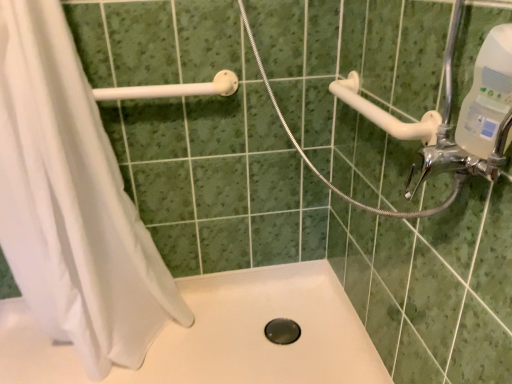
The image size is (512, 384). What are the coordinates of `chrome metallic faucet at upper right` in the screenshot? It's located at (458, 158).

This screenshot has width=512, height=384. What do you see at coordinates (282, 331) in the screenshot?
I see `black rubber hole at center` at bounding box center [282, 331].

In order to face black rubber hole at center, should I rotate leftwards or rightwards?

To align with it, rotate right about 3.227°.

This screenshot has height=384, width=512. In order to click on white plastic grab bar at upper left, the first shower in the left-to-right sequence in this screenshot , I will do `click(173, 89)`.

Identify the location of white plastic grab bar at upper right, which ranks as the first shower in right-to-left order. Image resolution: width=512 pixels, height=384 pixels. (386, 113).

This screenshot has height=384, width=512. What do you see at coordinates (262, 332) in the screenshot?
I see `white matte bath at center` at bounding box center [262, 332].

Measure the distance between point (40, 261) and camera.

The distance of point (40, 261) from camera is 1.26 meters.

This screenshot has width=512, height=384. What are the coordinates of `chrome metallic faucet at upper right` in the screenshot? It's located at (458, 158).

Is black rubber hole at center next to white plastic grab bar at upper right, which ranks as the first shower in right-to-left order, and touching it?

black rubber hole at center is not next to white plastic grab bar at upper right, which ranks as the first shower in right-to-left order, and they're not touching.

Find the location of a particular element. This screenshot has height=384, width=512. shower that is the 1st one when counting upward from the black rubber hole at center (from the image's perspective) is located at coordinates (386, 113).

How far apart are black rubber hole at center and white plastic grab bar at upper right, the 2th shower positioned from the left?

They are 35.98 inches apart.

From a real-world perspective, who is located higher, black rubber hole at center or white plastic grab bar at upper right, which ranks as the first shower in right-to-left order?

From a 3D spatial view, white plastic grab bar at upper right, which ranks as the first shower in right-to-left order, is above.

Which object is positioned more to the left, chrome metallic faucet at upper right or white fabric shower curtain at left?

white fabric shower curtain at left is more to the left.

Is white fabric shower curtain at left completely or partially inside chrome metallic faucet at upper right?

No, chrome metallic faucet at upper right does not contain white fabric shower curtain at left.

Are chrome metallic faucet at upper right and white fabric shower curtain at left located far from each other?

Actually, chrome metallic faucet at upper right and white fabric shower curtain at left are a little close together.

Which of these two, chrome metallic faucet at upper right or white fabric shower curtain at left, stands taller?

Standing taller between the two is white fabric shower curtain at left.

Locate an element on the screen. shower curtain lying on the left of black rubber hole at center is located at coordinates (72, 202).

Is black rubber hole at center not near white fabric shower curtain at left?

That's not correct — black rubber hole at center is a little close to white fabric shower curtain at left.

Is white fabric shower curtain at left completely or partially inside black rubber hole at center?

No, white fabric shower curtain at left is not a part of black rubber hole at center.

Looking at this image, from a real-world perspective, is white fabric shower curtain at left located beneath white plastic grab bar at upper left, which is the second shower from right to left?

Yes, from a real-world perspective, white fabric shower curtain at left is below white plastic grab bar at upper left, which is the second shower from right to left.

Is white fabric shower curtain at left oriented away from white plastic grab bar at upper left, the first shower in the left-to-right sequence?

That's right, white fabric shower curtain at left is facing away from white plastic grab bar at upper left, the first shower in the left-to-right sequence.

Is white fabric shower curtain at left situated inside white plastic grab bar at upper left, the first shower in the left-to-right sequence, or outside?

white fabric shower curtain at left exists outside the volume of white plastic grab bar at upper left, the first shower in the left-to-right sequence.

Is white fabric shower curtain at left behind white plastic grab bar at upper left, the first shower in the left-to-right sequence?

No, it is in front of white plastic grab bar at upper left, the first shower in the left-to-right sequence.

Between white plastic grab bar at upper right, which ranks as the first shower in right-to-left order, and black rubber hole at center, which one has more height?

white plastic grab bar at upper right, which ranks as the first shower in right-to-left order, is taller.

Considering the positions of point (410, 124) and point (287, 329), is point (410, 124) closer or farther from the camera than point (287, 329)?

Point (410, 124) appears to be closer to the viewer than point (287, 329).

You are a GUI agent. You are given a task and a screenshot of the screen. Output one action in this format:
    pyautogui.click(x=<x>, y=<y>)
    Task: Click on the 1st shower located above the black rubber hole at center (from a real-world perspective)
    
    Given the screenshot: What is the action you would take?
    pyautogui.click(x=386, y=113)

Is white plastic grab bar at upper right, the 2th shower positioned from the left, in front of or behind white matte bath at center in the image?

In the image, white plastic grab bar at upper right, the 2th shower positioned from the left, appears in front of white matte bath at center.

From a real-world perspective, is white plastic grab bar at upper right, the 2th shower positioned from the left, beneath white matte bath at center?

No, from a real-world perspective, white plastic grab bar at upper right, the 2th shower positioned from the left, is not under white matte bath at center.

How many degrees apart are the facing directions of white plastic grab bar at upper right, the 2th shower positioned from the left, and white matte bath at center?

0.759 degrees separate the facing orientations of white plastic grab bar at upper right, the 2th shower positioned from the left, and white matte bath at center.

Would you say white plastic grab bar at upper right, the 2th shower positioned from the left, is to the left or to the right of white matte bath at center in the picture?

From the image, it's evident that white plastic grab bar at upper right, the 2th shower positioned from the left, is to the right of white matte bath at center.

From the picture: Does chrome metallic faucet at upper right have a larger size compared to white plastic grab bar at upper left, which is the second shower from right to left?

Actually, chrome metallic faucet at upper right might be smaller than white plastic grab bar at upper left, which is the second shower from right to left.

Does chrome metallic faucet at upper right come behind white plastic grab bar at upper left, the first shower in the left-to-right sequence?

No.

Between chrome metallic faucet at upper right and white plastic grab bar at upper left, which is the second shower from right to left, which one appears on the right side from the viewer's perspective?

chrome metallic faucet at upper right.

Locate an element on the screen. The image size is (512, 384). shower on the right of black rubber hole at center is located at coordinates pyautogui.click(x=386, y=113).

In the image, there is a chrome metallic faucet at upper right. Where is `shower curtain below it (from a real-world perspective)`? The height and width of the screenshot is (384, 512). shower curtain below it (from a real-world perspective) is located at coordinates (72, 202).

When comparing their distances from white matte bath at center, does white fabric shower curtain at left or chrome metallic faucet at upper right seem further?

The object further to white matte bath at center is chrome metallic faucet at upper right.

Based on the photo, looking at the image, which one is located closer to white matte bath at center, chrome metallic faucet at upper right or white fabric shower curtain at left?

white fabric shower curtain at left is closer to white matte bath at center.

From the image, which object appears to be farther from white matte bath at center, white plastic grab bar at upper left, which is the second shower from right to left, or white fabric shower curtain at left?

white plastic grab bar at upper left, which is the second shower from right to left.

When comparing their distances from white plastic grab bar at upper right, which ranks as the first shower in right-to-left order, does white plastic grab bar at upper left, which is the second shower from right to left, or white fabric shower curtain at left seem closer?

white plastic grab bar at upper left, which is the second shower from right to left.

Based on their spatial positions, is white plastic grab bar at upper right, which ranks as the first shower in right-to-left order, or white fabric shower curtain at left further from black rubber hole at center?

Based on the image, white plastic grab bar at upper right, which ranks as the first shower in right-to-left order, appears to be further to black rubber hole at center.

Which object lies further to the anchor point black rubber hole at center, white fabric shower curtain at left or white plastic grab bar at upper left, the first shower in the left-to-right sequence?

white plastic grab bar at upper left, the first shower in the left-to-right sequence, is further to black rubber hole at center.

From the image, which object appears to be nearer to white matte bath at center, white plastic grab bar at upper right, the 2th shower positioned from the left, or white plastic grab bar at upper left, which is the second shower from right to left?

Among the two, white plastic grab bar at upper left, which is the second shower from right to left, is located nearer to white matte bath at center.

When comparing their distances from black rubber hole at center, does white plastic grab bar at upper right, which ranks as the first shower in right-to-left order, or chrome metallic faucet at upper right seem further?

Among the two, chrome metallic faucet at upper right is located further to black rubber hole at center.

What are the coordinates of `bath located between white fabric shower curtain at left and white plastic grab bar at upper right, which ranks as the first shower in right-to-left order, in the left-right direction` in the screenshot? It's located at (262, 332).

The width and height of the screenshot is (512, 384). Find the location of `bath between white fabric shower curtain at left and chrome metallic faucet at upper right in the horizontal direction`. bath between white fabric shower curtain at left and chrome metallic faucet at upper right in the horizontal direction is located at coordinates (262, 332).

Find the location of `shower curtain between white plastic grab bar at upper left, which is the second shower from right to left, and black rubber hole at center, in the vertical direction`. shower curtain between white plastic grab bar at upper left, which is the second shower from right to left, and black rubber hole at center, in the vertical direction is located at coordinates (72, 202).

This screenshot has width=512, height=384. I want to click on tap that lies between white plastic grab bar at upper left, which is the second shower from right to left, and white matte bath at center from top to bottom, so click(458, 158).